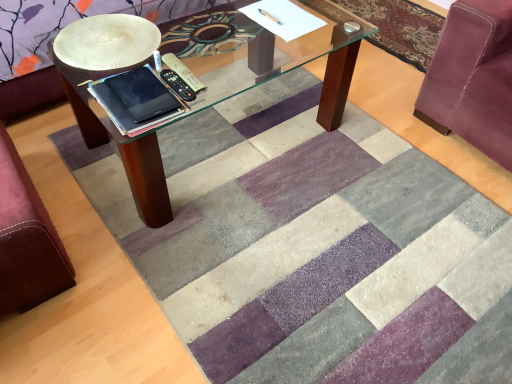
Question: Is velvet maroon swivel chair at right, marked as the 1th swivel chair in a right-to-left arrangement, inside or outside of velvet burgundy swivel chair at lower left, which is counted as the second swivel chair, starting from the right?

Choices:
 (A) inside
 (B) outside

Answer: (B)

Question: Is velvet maroon swivel chair at right, placed as the 2th swivel chair when sorted from left to right, bigger or smaller than velvet burgundy swivel chair at lower left, the 1th swivel chair in the left-to-right sequence?

Choices:
 (A) small
 (B) big

Answer: (B)

Question: Estimate the real-world distances between objects in this image. Which object is closer to the black plastic remote at center?

Choices:
 (A) velvet maroon swivel chair at right, placed as the 2th swivel chair when sorted from left to right
 (B) black matte tablet at center
 (C) velvet burgundy swivel chair at lower left, which is counted as the second swivel chair, starting from the right
 (D) silky purple rug at upper right

Answer: (B)

Question: Which is farther from the silky purple rug at upper right?

Choices:
 (A) black matte tablet at center
 (B) velvet burgundy swivel chair at lower left, the 1th swivel chair in the left-to-right sequence
 (C) black plastic remote at center
 (D) velvet maroon swivel chair at right, placed as the 2th swivel chair when sorted from left to right

Answer: (B)